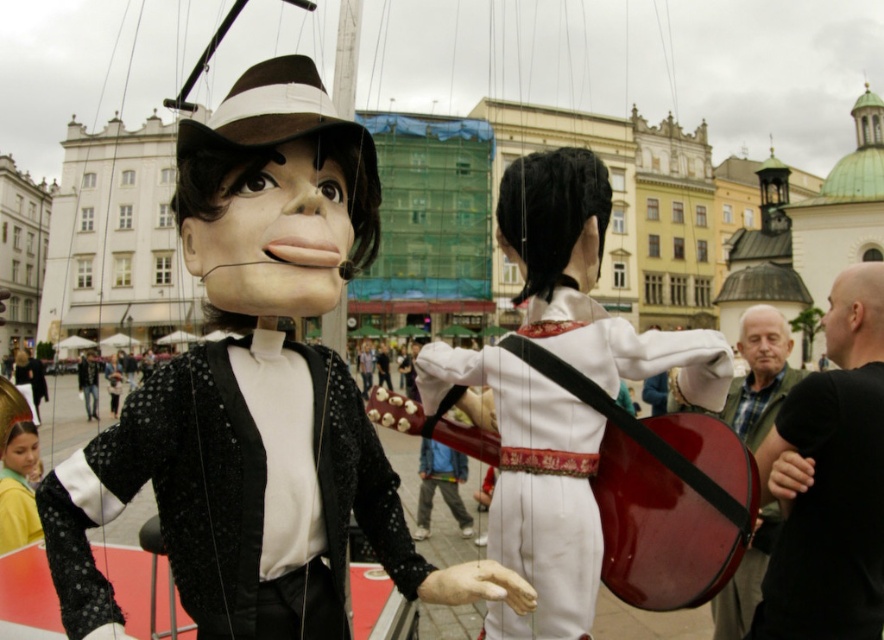
You are a costume designer preparing for a puppet show. You have two puppets to dress. The first puppet wears the black sequined jacket at center, and the second wears the green plaid shirt at right. If you need to choose a wider costume for a more dramatic effect, which one should you select?

The black sequened jacket at center is wider than the green plaid shirt at right, so you should select the black sequined jacket at center for a more dramatic effect.

You are a stagehand in a theater. You need to move the white matte guitar at center and the black leather jacket at upper right closer together so that they are only 5 meters apart. Given their current distance, is this adjustment feasible?

The white matte guitar at center is currently 11.95 meters away from the black leather jacket at upper right. To reduce the distance to 5 meters, you would need to move them closer by approximately 6.95 meters. This adjustment is feasible as long as there is enough space available in the theater to maneuver the objects into the desired positions.